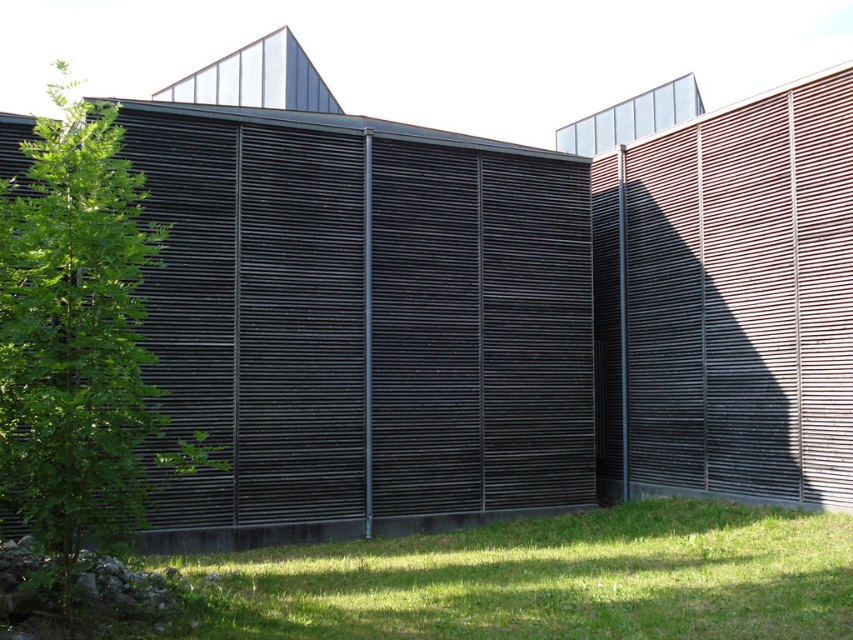
You are standing in front of the modern architectural structure and want to place a small potted plant exactly at the center of the green grass at lower center. According to the image, what are the coordinates where you should place the potted plant?

The coordinates for the center of the green grass at lower center are at point (544, 579), so you should place the potted plant there.

You are standing in front of the modern building with horizontal slats. You want to place a small potted plant on the ground at the location marked by point (544, 579). Based on the scene description, what is the surface type at that point?

The surface at point (544, 579) is green grass at lower center, so placing the potted plant there would be suitable as the ground is grassy.

You are a landscape architect designing a pathway between the green grass at lower center and the green leafy tree at left. Considering their thickness, which area would require more frequent maintenance due to growth patterns?

The green leafy tree at left requires more frequent maintenance because it is thicker than the green grass at lower center, leading to more growth and potential overgrowth issues.